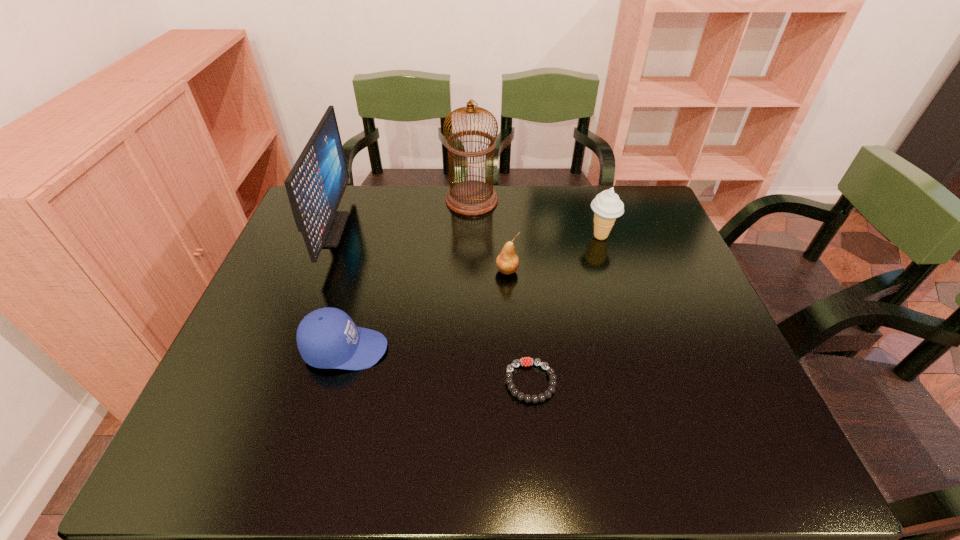
Identify the location of blank space located 0.190m on the back of the icecream. (587, 192).

The height and width of the screenshot is (540, 960). In order to click on vacant space located on the left of the pear in this screenshot , I will do `click(421, 271)`.

The width and height of the screenshot is (960, 540). Find the location of `vacant space situated on the front-facing side of the fifth tallest object`. vacant space situated on the front-facing side of the fifth tallest object is located at coordinates (563, 349).

Where is `free space located 0.170m on the back of the bracelet`? The height and width of the screenshot is (540, 960). free space located 0.170m on the back of the bracelet is located at coordinates (523, 304).

At what (x,y) coordinates should I click in order to perform the action: click on birdcage at the far edge. Please return your answer as a coordinate pair (x, y). Looking at the image, I should click on (471, 197).

The image size is (960, 540). In order to click on computer monitor that is at the far edge in this screenshot , I will do `click(315, 185)`.

Where is `icecream located at the far edge`? The width and height of the screenshot is (960, 540). icecream located at the far edge is located at coordinates (607, 206).

Find the location of a particular element. object present at the left edge is located at coordinates (315, 185).

Find the location of `object that is at the far left corner`. object that is at the far left corner is located at coordinates (315, 185).

The width and height of the screenshot is (960, 540). Identify the location of free space at the far edge. (561, 197).